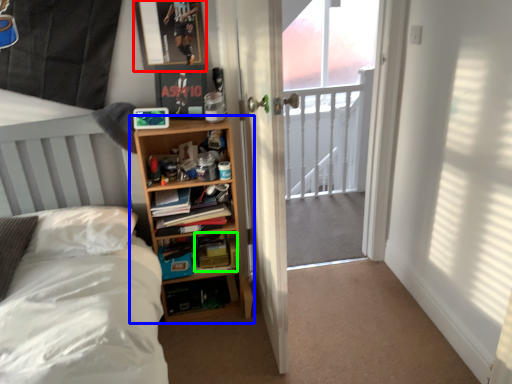
Question: Considering the real-world distances, which object is closest to picture frame (highlighted by a red box)? shelf (highlighted by a blue box) or paperback book (highlighted by a green box).

Choices:
 (A) shelf
 (B) paperback book

Answer: (A)